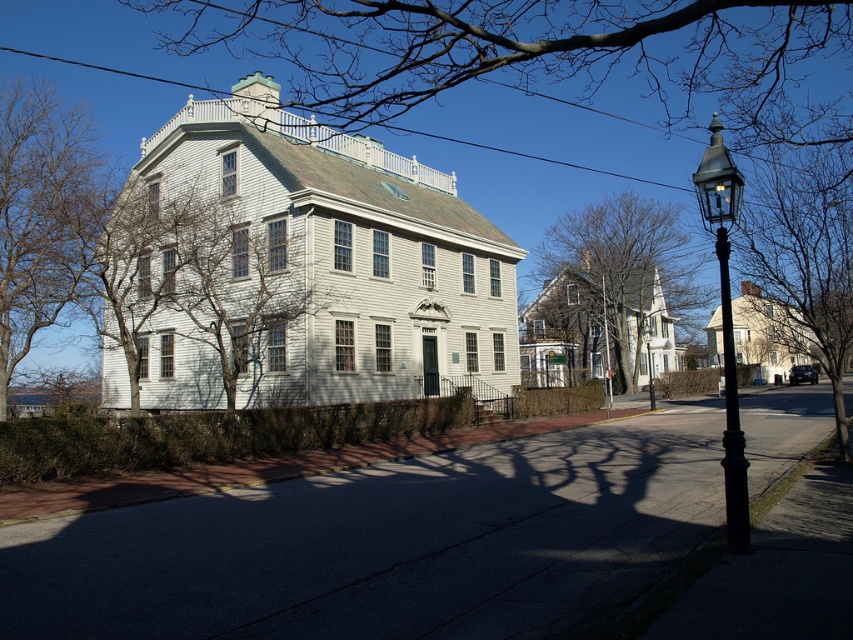
Question: Which object is closer to the camera taking this photo?

Choices:
 (A) green leafy tree at center
 (B) black metal streetlight at right

Answer: (B)

Question: Is bare branches at upper center bigger than green leafy tree at center?

Choices:
 (A) no
 (B) yes

Answer: (B)

Question: Can you confirm if bare branches at left is positioned above black metal streetlight at right?

Choices:
 (A) yes
 (B) no

Answer: (A)

Question: Which object is the farthest from the green leafy tree at center?

Choices:
 (A) black metal streetlight at right
 (B) bare branches at left

Answer: (A)

Question: Which object is the farthest from the bare branches at center?

Choices:
 (A) bare branches at upper center
 (B) green leafy tree at center
 (C) bare branches at left

Answer: (C)

Question: Considering the relative positions of green leafy tree at center and black metal streetlight at right in the image provided, where is green leafy tree at center located with respect to black metal streetlight at right?

Choices:
 (A) above
 (B) below

Answer: (A)